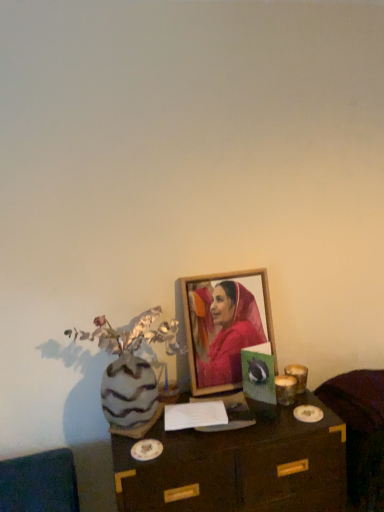
The width and height of the screenshot is (384, 512). Identify the location of vacant area on top of wooden table at center (from a real-world perspective). (229, 416).